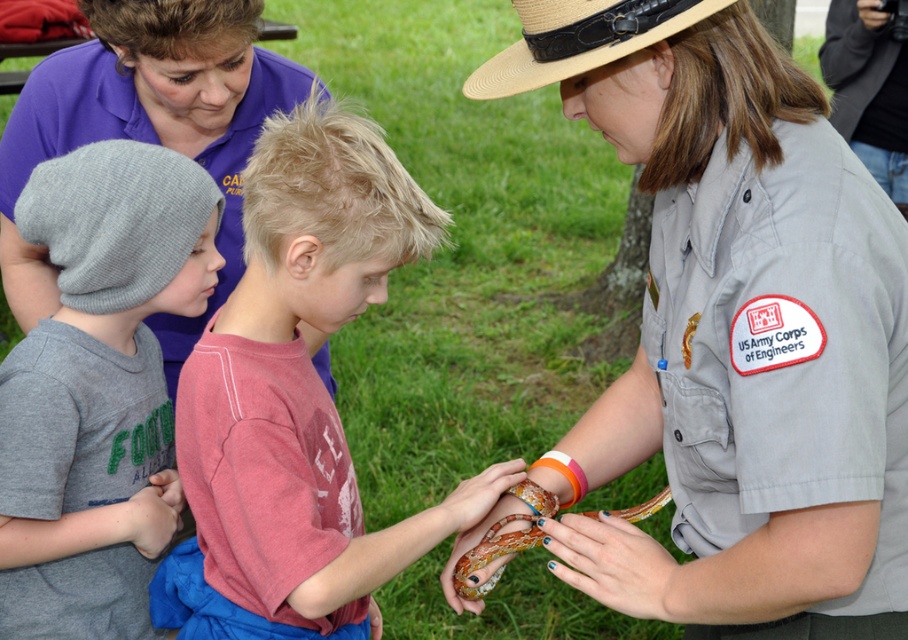
Can you confirm if multicolored painted nails at center is positioned to the left of multicolored scales snake at center?

In fact, multicolored painted nails at center is to the right of multicolored scales snake at center.

Measure the distance between multicolored painted nails at center and camera.

They are 1.44 meters apart.

This screenshot has width=908, height=640. Identify the location of multicolored painted nails at center. (617, 564).

Between matte red shirt at center and multicolored painted nails at center, which one is positioned higher?

matte red shirt at center

Is matte red shirt at center above multicolored painted nails at center?

Yes, matte red shirt at center is above multicolored painted nails at center.

Is point (319, 611) more distant than point (646, 552)?

Yes, it is.

This screenshot has height=640, width=908. Find the location of `matte red shirt at center`. matte red shirt at center is located at coordinates (297, 397).

Can you confirm if knit gray beanie at left is smaller than matte purple shirt at upper left?

Indeed, knit gray beanie at left has a smaller size compared to matte purple shirt at upper left.

Can you confirm if knit gray beanie at left is wider than matte purple shirt at upper left?

No.

This screenshot has width=908, height=640. Find the location of `knit gray beanie at left`. knit gray beanie at left is located at coordinates (80, 419).